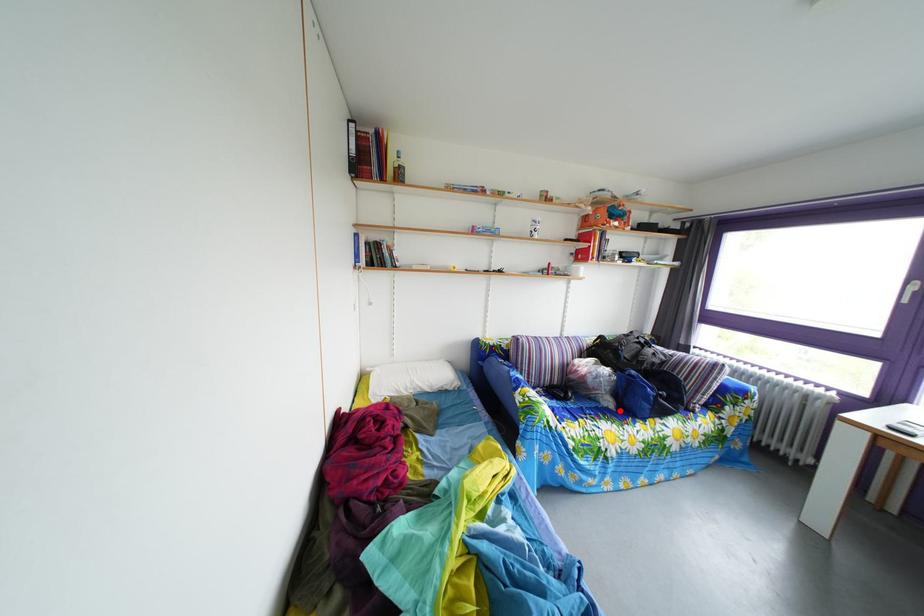
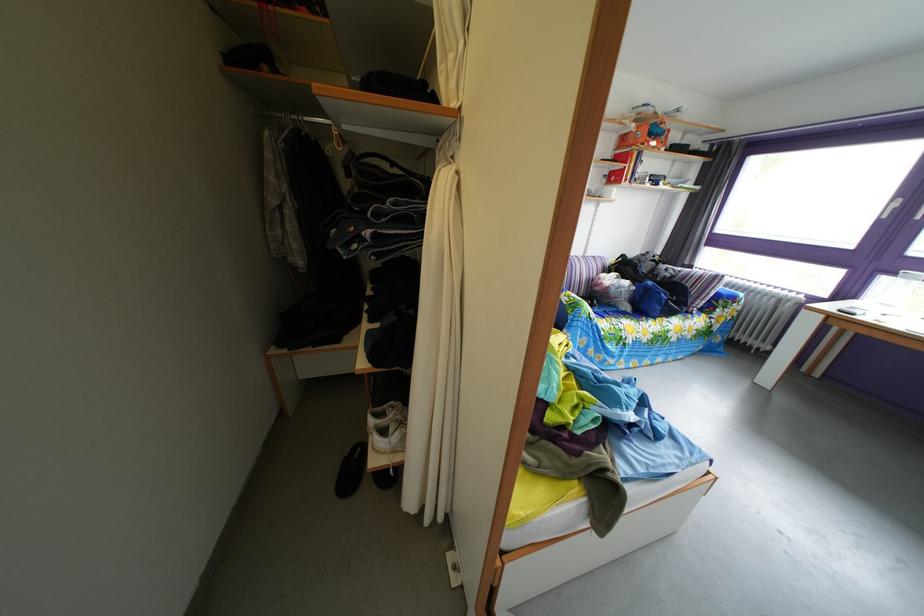
The point at the highlighted location is marked in the first image. Where is the corresponding point in the second image?

(638, 315)